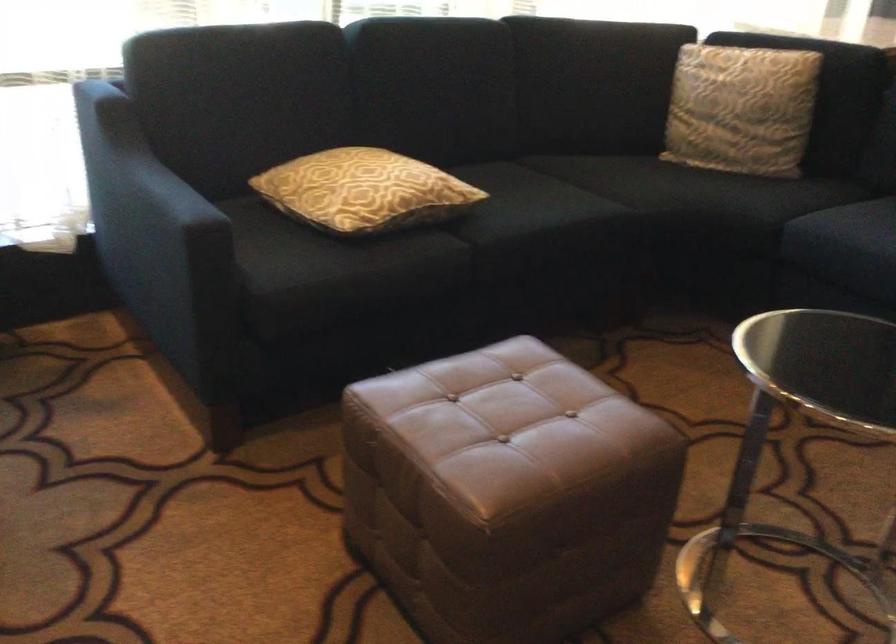
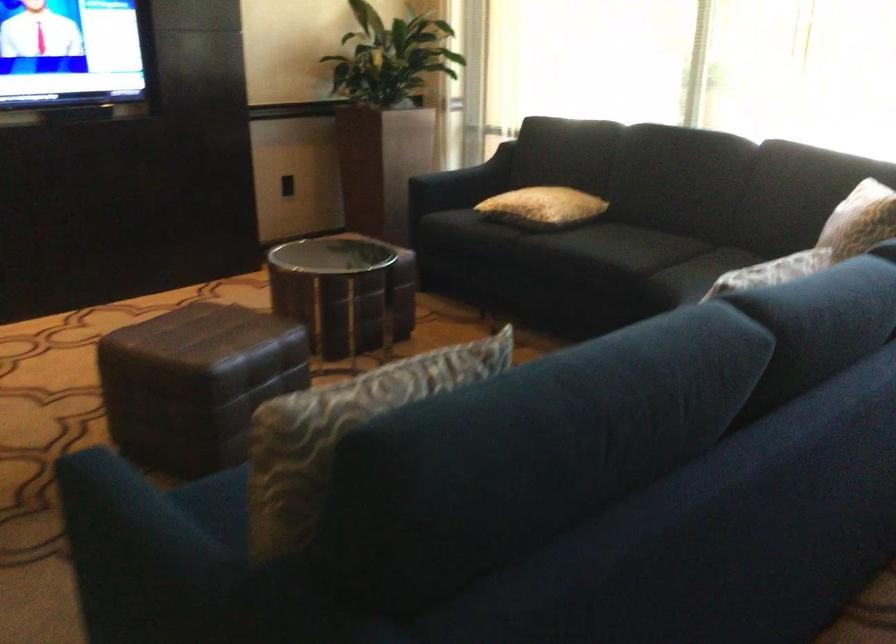
Where in the second image is the point corresponding to pixel 204 214 from the first image?

(460, 184)